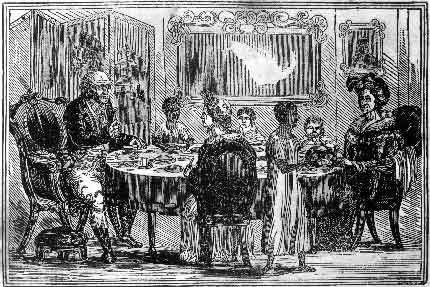
What are the coordinates of `paintings` in the screenshot? It's located at (282, 44), (360, 41).